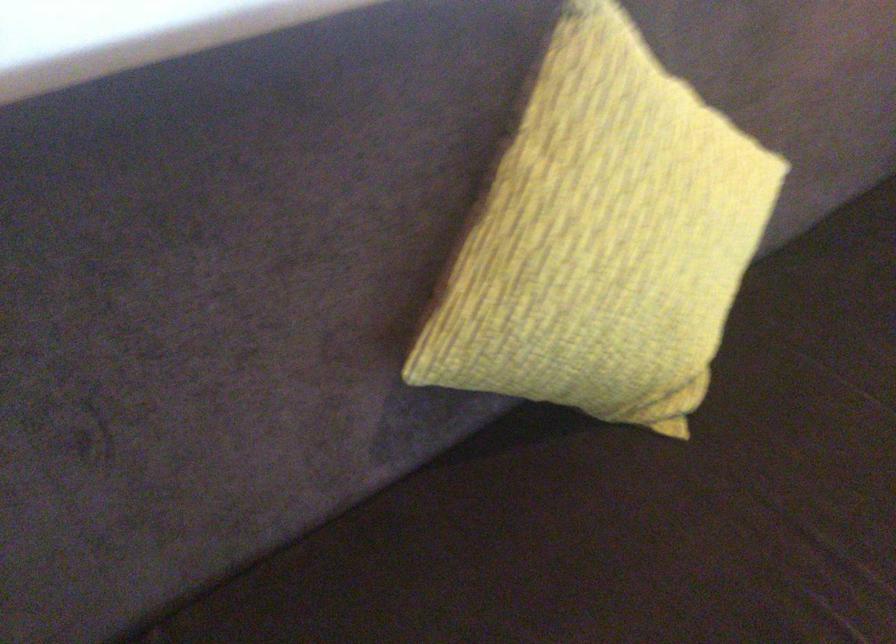
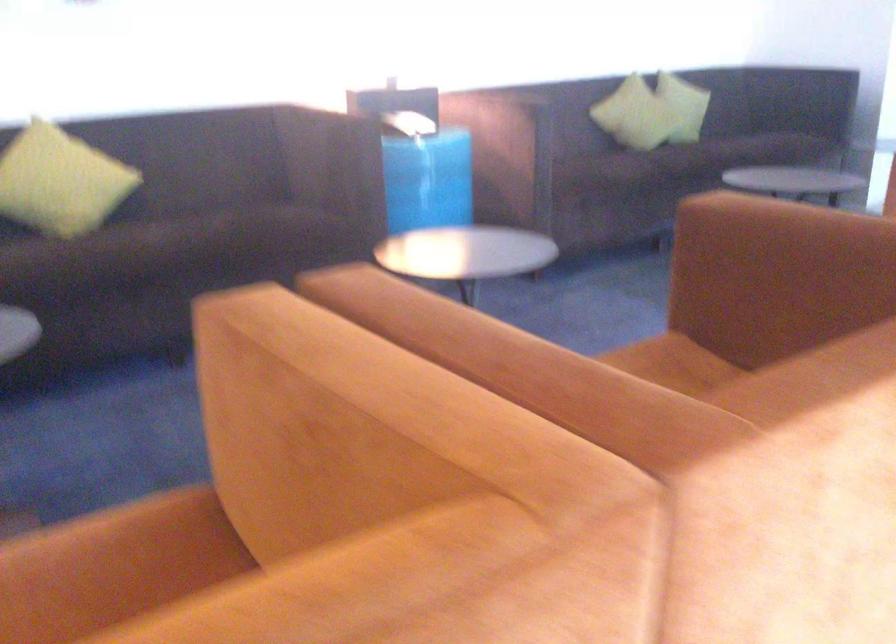
In a continuous first-person perspective shot, in which direction is the camera moving?

The cameraman moved toward right, backward.